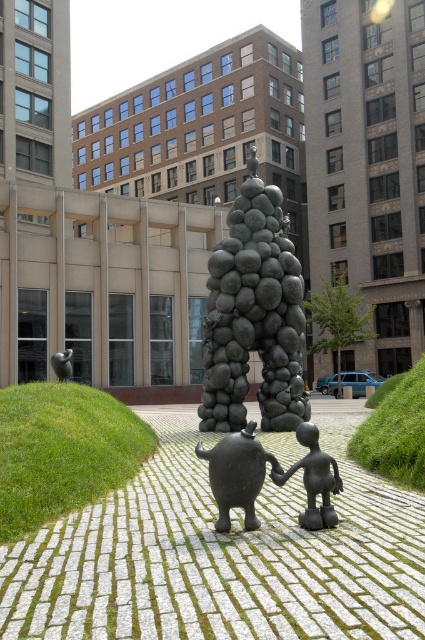
Looking at this image, who is more distant from viewer, (302, 340) or (311, 483)?

The point (302, 340) is more distant.

Can you confirm if dark gray textured sculpture at center is shorter than matte black figure at center?

No, dark gray textured sculpture at center is not shorter than matte black figure at center.

Does point (223, 300) lie behind point (331, 509)?

That is True.

What are the coordinates of `dark gray textured sculpture at center` in the screenshot? It's located at (254, 316).

I want to click on dark gray textured sculpture at center, so click(254, 316).

Between point (224, 301) and point (251, 452), which one is positioned in front?

Point (251, 452)

Where is `dark gray textured sculpture at center`? This screenshot has width=425, height=640. dark gray textured sculpture at center is located at coordinates (254, 316).

Which is more to the right, matte black sculpture at center or matte black figure at center?

Positioned to the right is matte black figure at center.

Can you confirm if matte black sculpture at center is bigger than matte black figure at center?

Correct, matte black sculpture at center is larger in size than matte black figure at center.

At what (x,y) coordinates should I click in order to perform the action: click on matte black sculpture at center. Please return your answer as a coordinate pair (x, y). This screenshot has height=640, width=425. Looking at the image, I should click on (237, 474).